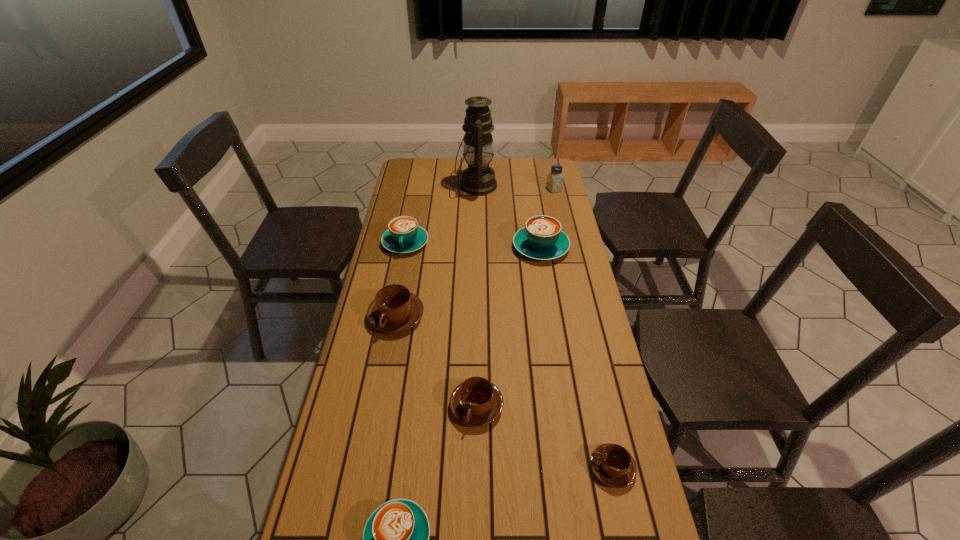
Locate an element on the screen. This screenshot has width=960, height=540. object that is the closest one to the fifth farthest cappuccino is located at coordinates (476, 402).

Identify which cappuccino is the fourth nearest to the second brown cappuccino from left to right. Please provide its 2D coordinates. Your answer should be formatted as a tuple, i.e. [(x, y)], where the tuple contains the x and y coordinates of a point satisfying the conditions above.

[(542, 239)]

Locate which cappuccino is the second closest to the second brown cappuccino from left to right. Please provide its 2D coordinates. Your answer should be formatted as a tuple, i.e. [(x, y)], where the tuple contains the x and y coordinates of a point satisfying the conditions above.

[(394, 309)]

Where is `turquoise cappuccino that can be found as the second closest to the saltshaker`? turquoise cappuccino that can be found as the second closest to the saltshaker is located at coordinates (404, 235).

Locate an element on the screen. The image size is (960, 540). turquoise cappuccino that can be found as the closest to the oil lamp is located at coordinates (542, 239).

Point out which brown cappuccino is positioned as the second nearest to the shortest cappuccino. Please provide its 2D coordinates. Your answer should be formatted as a tuple, i.e. [(x, y)], where the tuple contains the x and y coordinates of a point satisfying the conditions above.

[(394, 309)]

Where is `the closest brown cappuccino to the saltshaker`? the closest brown cappuccino to the saltshaker is located at coordinates (394, 309).

The image size is (960, 540). I want to click on free space that satisfies the following two spatial constraints: 1. on the front side of the saltshaker; 2. on the side of the shortest cappuccino with the handle, so click(618, 468).